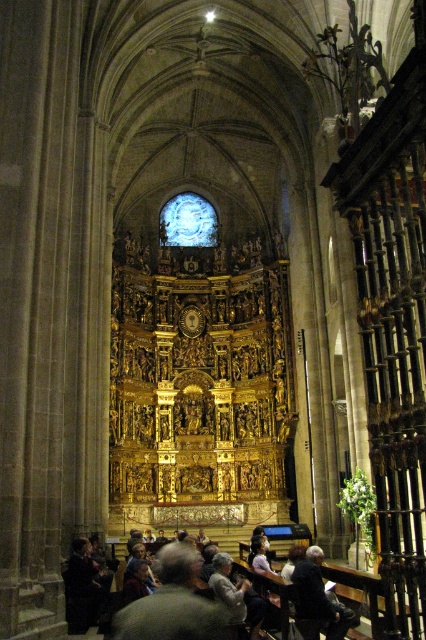
Can you confirm if dark blue fabric at lower center is positioned to the right of dark gray sweater at lower left?

Indeed, dark blue fabric at lower center is positioned on the right side of dark gray sweater at lower left.

Between dark blue fabric at lower center and dark gray sweater at lower left, which one appears on the left side from the viewer's perspective?

From the viewer's perspective, dark gray sweater at lower left appears more on the left side.

Between point (293, 576) and point (350, 573), which one is positioned behind?

Positioned behind is point (350, 573).

Identify the location of dark blue fabric at lower center. The height and width of the screenshot is (640, 426). (317, 600).

Does gray wool sweater at lower center have a lesser width compared to dark gray sweater at lower left?

Yes.

Is gray wool sweater at lower center to the right of dark gray sweater at lower left from the viewer's perspective?

Incorrect, gray wool sweater at lower center is not on the right side of dark gray sweater at lower left.

Where is `gray wool sweater at lower center`? This screenshot has height=640, width=426. gray wool sweater at lower center is located at coordinates (172, 604).

Locate an element on the screen. The image size is (426, 640). gray wool sweater at lower center is located at coordinates (172, 604).

Does gray wool sweater at lower center have a smaller size compared to dark blue fabric at lower center?

Actually, gray wool sweater at lower center might be larger than dark blue fabric at lower center.

Locate an element on the screen. The width and height of the screenshot is (426, 640). gray wool sweater at lower center is located at coordinates (172, 604).